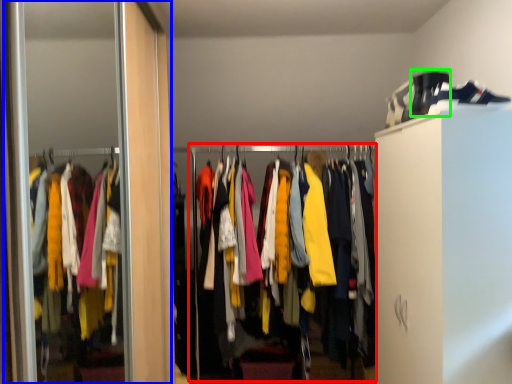
Question: Which is farther away from closet (highlighted by a red box)? screen door (highlighted by a blue box) or shoe (highlighted by a green box)?

Choices:
 (A) screen door
 (B) shoe

Answer: (A)